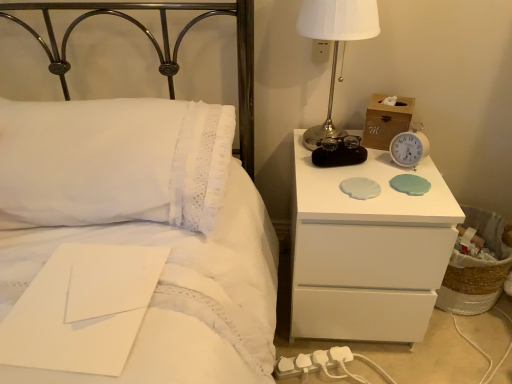
Question: Considering the relative sizes of white glossy nightstand at right and white plastic alarm clock at upper right, marked as the first alarm clock in a left-to-right arrangement, in the image provided, is white glossy nightstand at right taller than white plastic alarm clock at upper right, marked as the first alarm clock in a left-to-right arrangement,?

Choices:
 (A) yes
 (B) no

Answer: (A)

Question: Considering the relative sizes of white glossy nightstand at right and white plastic alarm clock at upper right, marked as the first alarm clock in a left-to-right arrangement, in the image provided, is white glossy nightstand at right shorter than white plastic alarm clock at upper right, marked as the first alarm clock in a left-to-right arrangement,?

Choices:
 (A) yes
 (B) no

Answer: (B)

Question: Is white glossy nightstand at right oriented towards white plastic alarm clock at upper right, which is counted as the 2th alarm clock, starting from the right?

Choices:
 (A) no
 (B) yes

Answer: (A)

Question: From a real-world perspective, does white glossy nightstand at right sit lower than white plastic alarm clock at upper right, marked as the first alarm clock in a left-to-right arrangement?

Choices:
 (A) yes
 (B) no

Answer: (A)

Question: Is white glossy nightstand at right turned away from white plastic alarm clock at upper right, which is counted as the 2th alarm clock, starting from the right?

Choices:
 (A) yes
 (B) no

Answer: (B)

Question: Is white plastic alarm clock at upper right, the 2th alarm clock viewed from the left, taller or shorter than white plastic alarm clock at upper right, which is counted as the 2th alarm clock, starting from the right?

Choices:
 (A) short
 (B) tall

Answer: (B)

Question: From a real-world perspective, relative to white plastic alarm clock at upper right, marked as the first alarm clock in a left-to-right arrangement, is white plastic alarm clock at upper right, the 2th alarm clock viewed from the left, vertically above or below?

Choices:
 (A) above
 (B) below

Answer: (A)

Question: In terms of size, does white plastic alarm clock at upper right, the first alarm clock from the right, appear bigger or smaller than white plastic alarm clock at upper right, marked as the first alarm clock in a left-to-right arrangement?

Choices:
 (A) big
 (B) small

Answer: (A)

Question: Is white plastic alarm clock at upper right, the 2th alarm clock viewed from the left, wider or thinner than white plastic alarm clock at upper right, marked as the first alarm clock in a left-to-right arrangement?

Choices:
 (A) thin
 (B) wide

Answer: (A)

Question: Based on their positions, is white plastic charger at lower center located to the left or right of white lace pillow at upper left?

Choices:
 (A) right
 (B) left

Answer: (A)

Question: Is white plastic charger at lower center in front of or behind white lace pillow at upper left in the image?

Choices:
 (A) behind
 (B) front

Answer: (A)

Question: From a real-world perspective, is white plastic charger at lower center positioned above or below white lace pillow at upper left?

Choices:
 (A) above
 (B) below

Answer: (B)

Question: In terms of size, does white plastic charger at lower center appear bigger or smaller than white lace pillow at upper left?

Choices:
 (A) small
 (B) big

Answer: (A)

Question: Which is correct: white lace pillow at upper left is inside silver metallic bedside lamp at upper right, or outside of it?

Choices:
 (A) inside
 (B) outside

Answer: (B)

Question: From a real-world perspective, is white lace pillow at upper left physically located above or below silver metallic bedside lamp at upper right?

Choices:
 (A) above
 (B) below

Answer: (B)